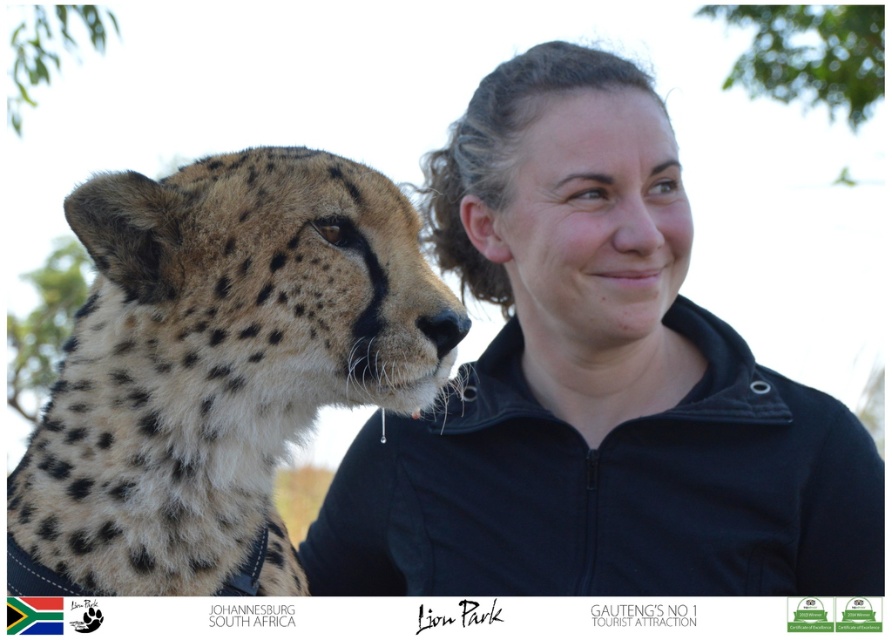
Question: Observing the image, what is the correct spatial positioning of matte black jacket at center in reference to spotted fur cheetah at left?

Choices:
 (A) below
 (B) above

Answer: (B)

Question: Which object is farther from the camera taking this photo?

Choices:
 (A) spotted fur cheetah at left
 (B) matte black jacket at center

Answer: (B)

Question: Does matte black jacket at center come behind spotted fur cheetah at left?

Choices:
 (A) no
 (B) yes

Answer: (B)

Question: Which of the following is the closest to the observer?

Choices:
 (A) spotted fur cheetah at left
 (B) matte black jacket at center

Answer: (A)

Question: Which object is closer to the camera taking this photo?

Choices:
 (A) spotted fur cheetah at left
 (B) matte black jacket at center

Answer: (A)

Question: In this image, where is matte black jacket at center located relative to spotted fur cheetah at left?

Choices:
 (A) above
 (B) below

Answer: (A)